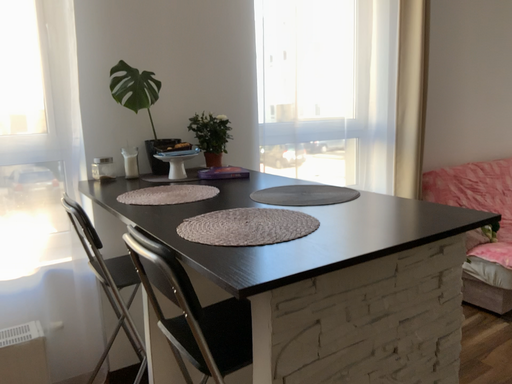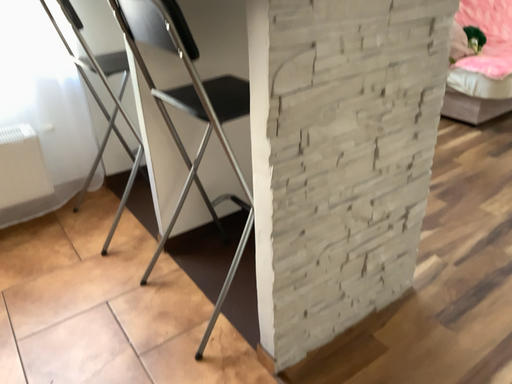
Question: Which way did the camera rotate in the video?

Choices:
 (A) rotated upward
 (B) rotated downward

Answer: (B)